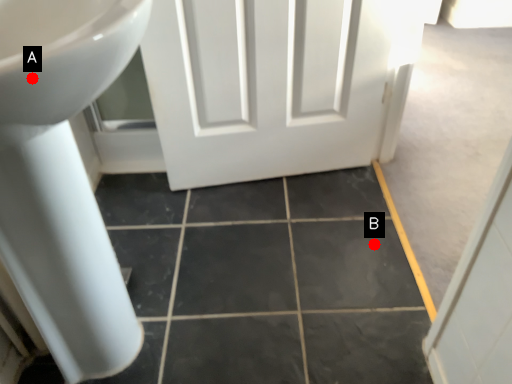
Question: Two points are circled on the image, labeled by A and B beside each circle. Which point is closer to the camera?

Choices:
 (A) A is closer
 (B) B is closer

Answer: (A)